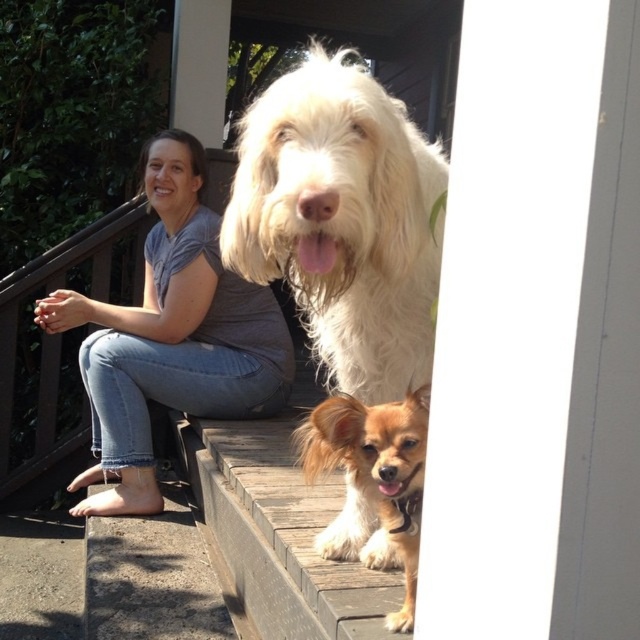
You are standing in front of the staircase and want to place a small decoration between the two points, point (193,157) and point (301,429). Which point should the decoration be closer to in order to be nearer to the viewer?

The decoration should be closer to point (193,157) because it is closer to the viewer than point (301,429).

You are a photographer trying to capture a group photo of the white fluffy dog at center and the golden fur dog at center. If you want to ensure both dogs are fully visible in the frame, which dog should you position closer to the camera to avoid cropping?

The white fluffy dog at center is wider than the golden fur dog at center, so positioning the white fluffy dog at center closer to the camera will help ensure both dogs are fully visible without cropping.